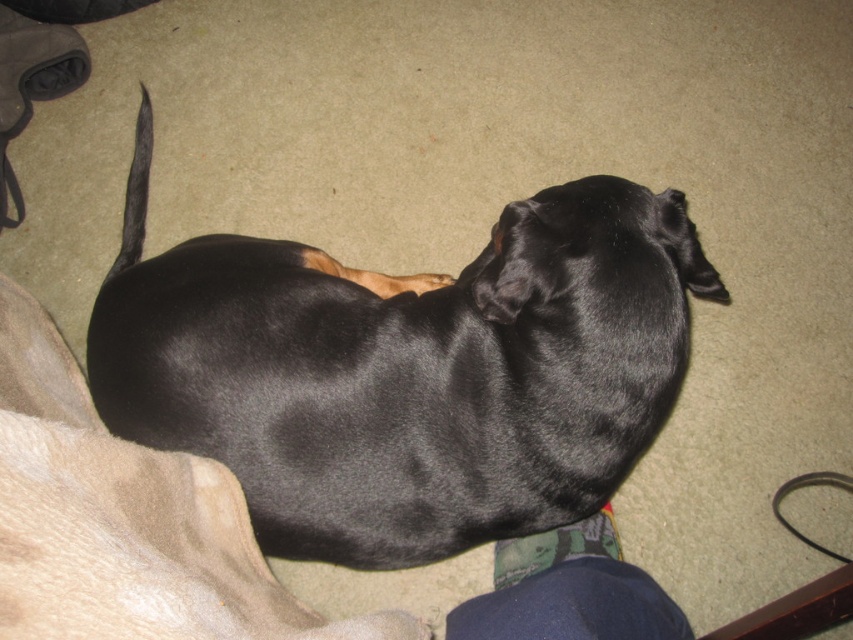
Question: Is shiny black dog at center thinner than black rubber leash at lower right?

Choices:
 (A) no
 (B) yes

Answer: (A)

Question: Can you confirm if shiny black dog at center is positioned to the left of black rubber leash at lower right?

Choices:
 (A) yes
 (B) no

Answer: (A)

Question: Can you confirm if shiny black dog at center is wider than black rubber leash at lower right?

Choices:
 (A) yes
 (B) no

Answer: (A)